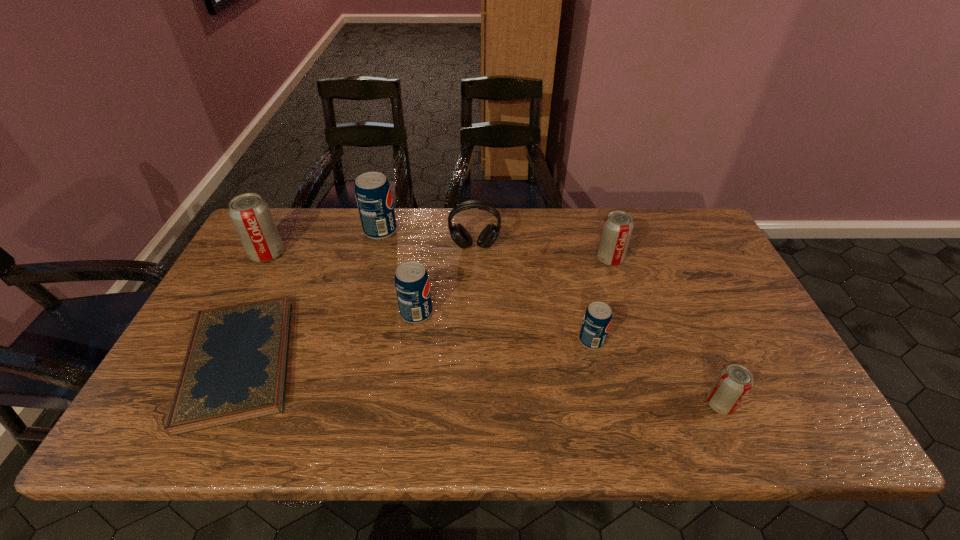
Point out which blue pop is positioned as the nearest to the biggest gray soda can. Please provide its 2D coordinates. Your answer should be formatted as a tuple, i.e. [(x, y)], where the tuple contains the x and y coordinates of a point satisfying the conditions above.

[(373, 194)]

Identify the location of the closest gray soda can to the leftmost soda can. (617, 228).

Identify which gray soda can is the nearest to the second gray soda can from left to right. Please provide its 2D coordinates. Your answer should be formatted as a tuple, i.e. [(x, y)], where the tuple contains the x and y coordinates of a point satisfying the conditions above.

[(735, 381)]

Where is `free space that satisfies the following two spatial constraints: 1. on the earcups of the gray headset; 2. on the right side of the rightmost gray soda can`? This screenshot has height=540, width=960. free space that satisfies the following two spatial constraints: 1. on the earcups of the gray headset; 2. on the right side of the rightmost gray soda can is located at coordinates (472, 404).

This screenshot has width=960, height=540. Identify the location of free location that satisfies the following two spatial constraints: 1. on the earcups of the second object from right to left; 2. on the right side of the gray headset. (474, 259).

Identify the location of free space that satisfies the following two spatial constraints: 1. on the front side of the biggest gray soda can; 2. on the left side of the rightmost object. (188, 404).